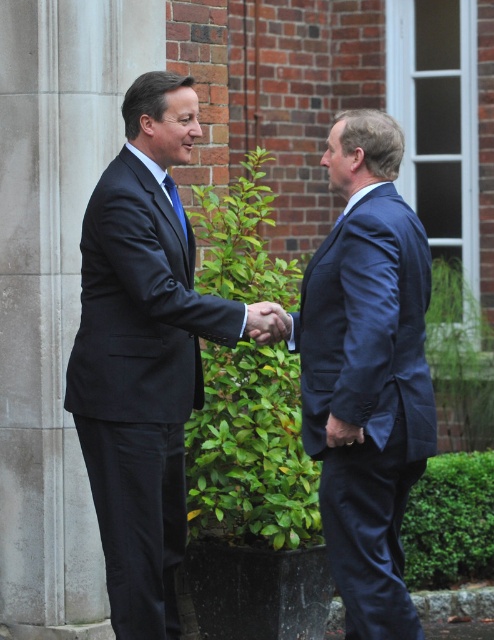
Question: Is the position of matte black suit at center less distant than that of blue silk tie at center?

Choices:
 (A) no
 (B) yes

Answer: (B)

Question: Does matte black suit at center come in front of navy blue suit at center?

Choices:
 (A) no
 (B) yes

Answer: (A)

Question: Based on their relative distances, which object is nearer to the matte black suit at center?

Choices:
 (A) navy blue suit at center
 (B) blue silk tie at center

Answer: (B)

Question: In this image, where is matte black suit at center located relative to blue silk tie at center?

Choices:
 (A) below
 (B) above

Answer: (A)

Question: Which point is farther from the camera taking this photo?

Choices:
 (A) (180, 204)
 (B) (183, 243)
 (C) (313, 266)

Answer: (A)

Question: Which point is closer to the camera?

Choices:
 (A) matte black suit at center
 (B) navy blue suit at center
 (C) blue silk tie at center

Answer: (B)